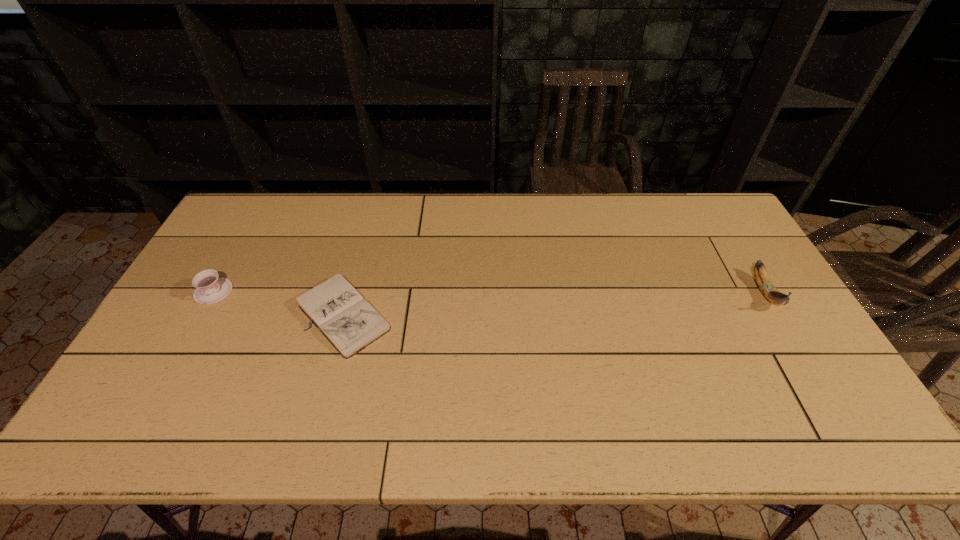
Where is `free spot between the shortest object and the rightmost object`? The height and width of the screenshot is (540, 960). free spot between the shortest object and the rightmost object is located at coordinates (555, 303).

Find the location of `free space between the rightmost object and the shortest object`. free space between the rightmost object and the shortest object is located at coordinates (555, 303).

Find the location of `empty space between the teacup and the rightmost object`. empty space between the teacup and the rightmost object is located at coordinates (490, 292).

Locate an element on the screen. vacant area that lies between the leftmost object and the rightmost object is located at coordinates (490, 292).

Where is `empty space between the tallest object and the teacup`? The image size is (960, 540). empty space between the tallest object and the teacup is located at coordinates (490, 292).

Identify the location of blank region between the shortest object and the teacup. This screenshot has height=540, width=960. (279, 302).

Locate an element on the screen. The image size is (960, 540). vacant area that lies between the notebook and the rightmost object is located at coordinates (555, 303).

I want to click on vacant area between the rightmost object and the shortest object, so click(x=555, y=303).

Point out which object is positioned as the second nearest to the shortest object. Please provide its 2D coordinates. Your answer should be formatted as a tuple, i.e. [(x, y)], where the tuple contains the x and y coordinates of a point satisfying the conditions above.

[(765, 285)]

Choose which object is the second nearest neighbor to the leftmost object. Please provide its 2D coordinates. Your answer should be formatted as a tuple, i.e. [(x, y)], where the tuple contains the x and y coordinates of a point satisfying the conditions above.

[(765, 285)]